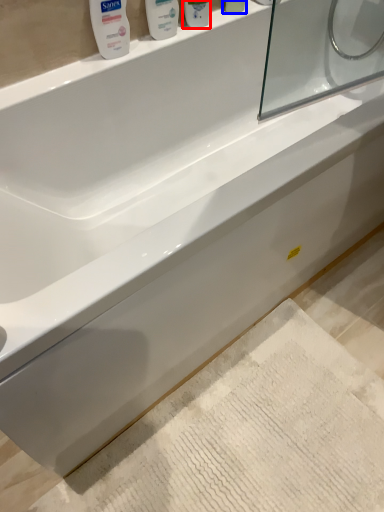
Question: Which object is further to the camera taking this photo, mouthwash (highlighted by a red box) or mouthwash (highlighted by a blue box)?

Choices:
 (A) mouthwash
 (B) mouthwash

Answer: (B)